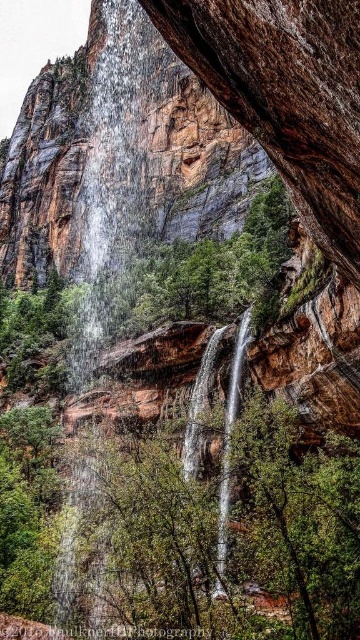
You are standing in the natural scene described. You want to take a photo of the translucent glass waterfall at left. Where should you position yourself to capture it in the frame?

To capture the translucent glass waterfall at left in your photo, position yourself so that the camera is aimed at the coordinates point (110, 170), which is the 2D location of the translucent glass waterfall at left in the scene.

Consider the image. You are a photographer aiming to capture both the translucent glass waterfall at left and the clear glass waterfall at center in a single shot. Based on their positions, which waterfall should you focus on first to ensure both are in frame?

The translucent glass waterfall at left is above the clear glass waterfall at center, so you should focus on the translucent glass waterfall at left first to ensure both are in frame.

You are an interior designer planning to place both the translucent glass waterfall at left and the clear glass waterfall at center in a client room. The client wants to know which one is bigger. What do you tell them?

The translucent glass waterfall at left is bigger than the clear glass waterfall at center.